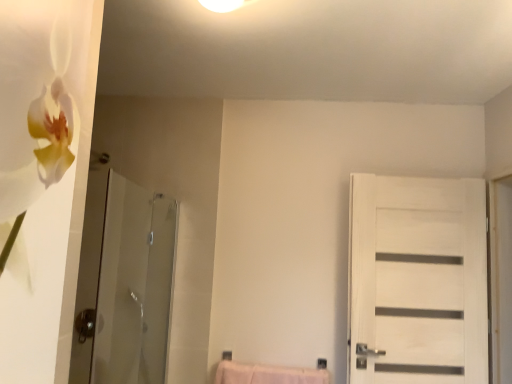
Question: Does transparent glass shower door at left have a smaller size compared to white wood door at right?

Choices:
 (A) yes
 (B) no

Answer: (B)

Question: Does transparent glass shower door at left have a larger size compared to white wood door at right?

Choices:
 (A) yes
 (B) no

Answer: (A)

Question: From the image's perspective, is transparent glass shower door at left below white wood door at right?

Choices:
 (A) yes
 (B) no

Answer: (B)

Question: Is transparent glass shower door at left positioned before white wood door at right?

Choices:
 (A) yes
 (B) no

Answer: (A)

Question: Can you confirm if transparent glass shower door at left is shorter than white wood door at right?

Choices:
 (A) yes
 (B) no

Answer: (A)

Question: From a real-world perspective, is transparent glass shower door at left physically below white wood door at right?

Choices:
 (A) yes
 (B) no

Answer: (A)

Question: From the image's perspective, is white wood door at right on transparent glass shower door at left?

Choices:
 (A) yes
 (B) no

Answer: (B)

Question: Is white wood door at right thinner than transparent glass shower door at left?

Choices:
 (A) yes
 (B) no

Answer: (A)

Question: Is white wood door at right oriented towards transparent glass shower door at left?

Choices:
 (A) yes
 (B) no

Answer: (B)

Question: Is white wood door at right outside transparent glass shower door at left?

Choices:
 (A) yes
 (B) no

Answer: (A)

Question: Can you confirm if white wood door at right is taller than transparent glass shower door at left?

Choices:
 (A) no
 (B) yes

Answer: (B)

Question: Is white wood door at right in contact with transparent glass shower door at left?

Choices:
 (A) no
 (B) yes

Answer: (A)

Question: Considering the positions of white wood door at right and transparent glass shower door at left in the image, is white wood door at right wider or thinner than transparent glass shower door at left?

Choices:
 (A) wide
 (B) thin

Answer: (B)